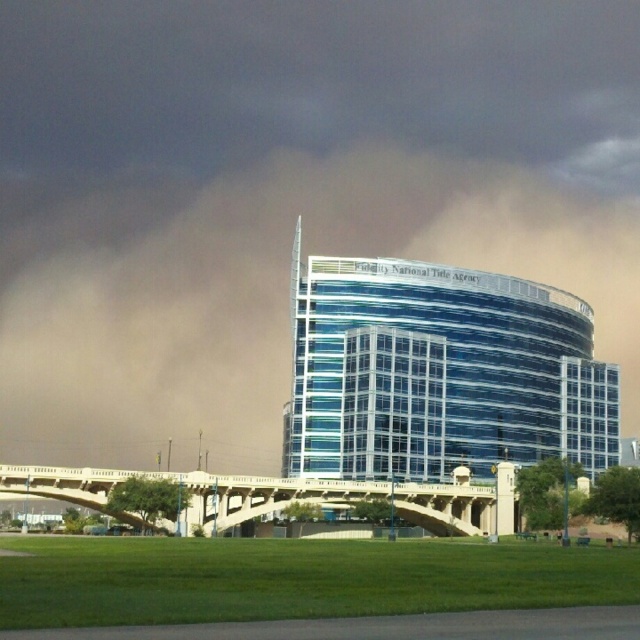
Question: Is brown dusty cloud at upper center thinner than beige concrete bridge at center?

Choices:
 (A) yes
 (B) no

Answer: (B)

Question: Which object appears farthest from the camera in this image?

Choices:
 (A) beige concrete bridge at center
 (B) blue glass building at center
 (C) brown dusty cloud at upper center

Answer: (C)

Question: Which object appears closest to the camera in this image?

Choices:
 (A) beige concrete bridge at center
 (B) blue glass building at center
 (C) brown dusty cloud at upper center

Answer: (A)

Question: Which of the following is the closest to the observer?

Choices:
 (A) brown dusty cloud at upper center
 (B) blue glass building at center
 (C) beige concrete bridge at center

Answer: (C)

Question: Is blue glass building at center wider than beige concrete bridge at center?

Choices:
 (A) yes
 (B) no

Answer: (B)

Question: Does blue glass building at center have a smaller size compared to beige concrete bridge at center?

Choices:
 (A) yes
 (B) no

Answer: (B)